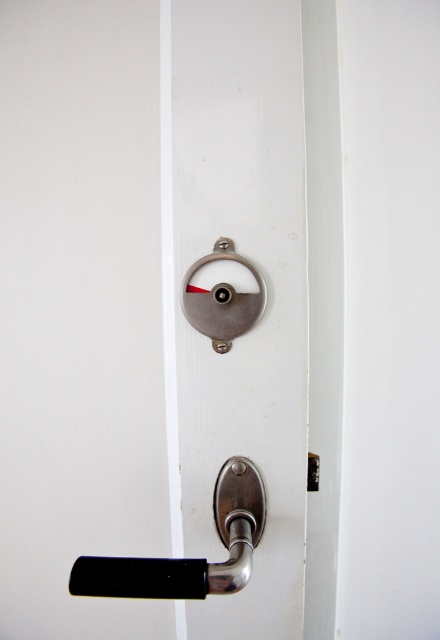
Based on the photo, you are a delivery person trying to deliver a package to an apartment. The door has a metallic silver lock at center and a black matte door handle at lower center. You need to unlock the door before ringing the doorbell. Which component should you interact with first?

You should interact with the metallic silver lock at center first because it is the locking mechanism, and you need to unlock it before using the black matte door handle at lower center to open the door.

You are trying to determine which lock to replace on the door. The door has a metallic silver lock at center and a satin silver lock at center. Based on their sizes, which lock would require a wider space for installation?

The metallic silver lock at center has a larger width than the satin silver lock at center, so it would require a wider space for installation.

You are a delivery person trying to deliver a package to a house. The package requires a signature, so you need to see the person through the peephole. The peephole is located at the center of the door. You are standing 5 feet away from the door. Can you reach the metallic silver lock at center to check if the peephole is functional without moving closer than 5 feet?

The metallic silver lock at center and camera are 19.84 inches apart. Since you are 5 feet away from the door, which is 60 inches, and the distance between the lock and the peephole is 19.84 inches, you can reach the metallic silver lock at center to check the peephole functionality without moving closer than 5 feet.